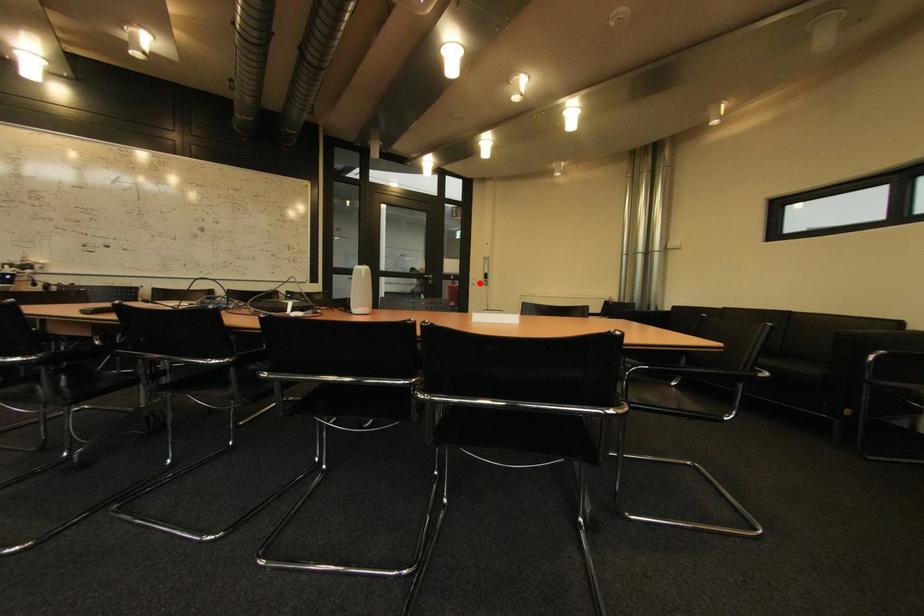
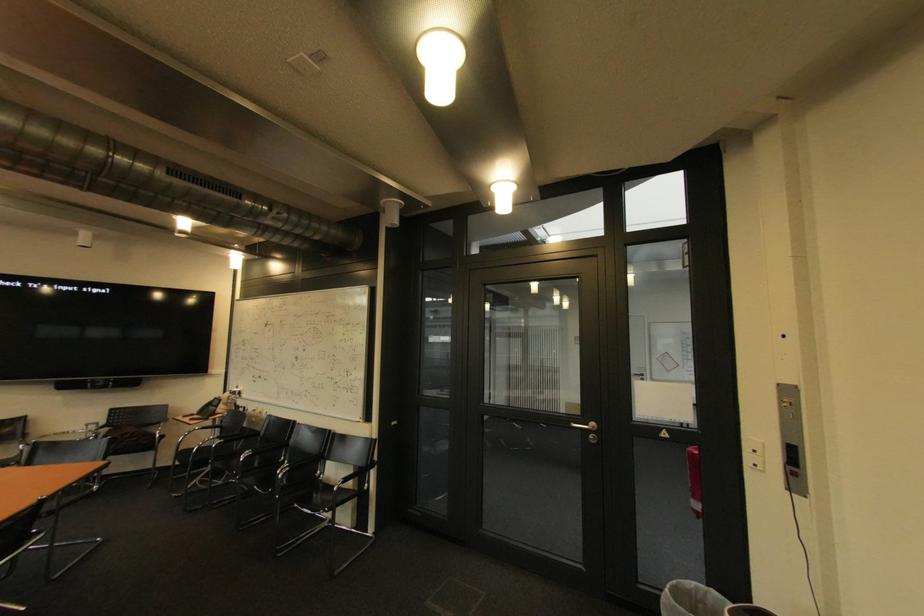
Locate, in the second image, the point that corresponds to the highlighted location in the first image.

(757, 459)